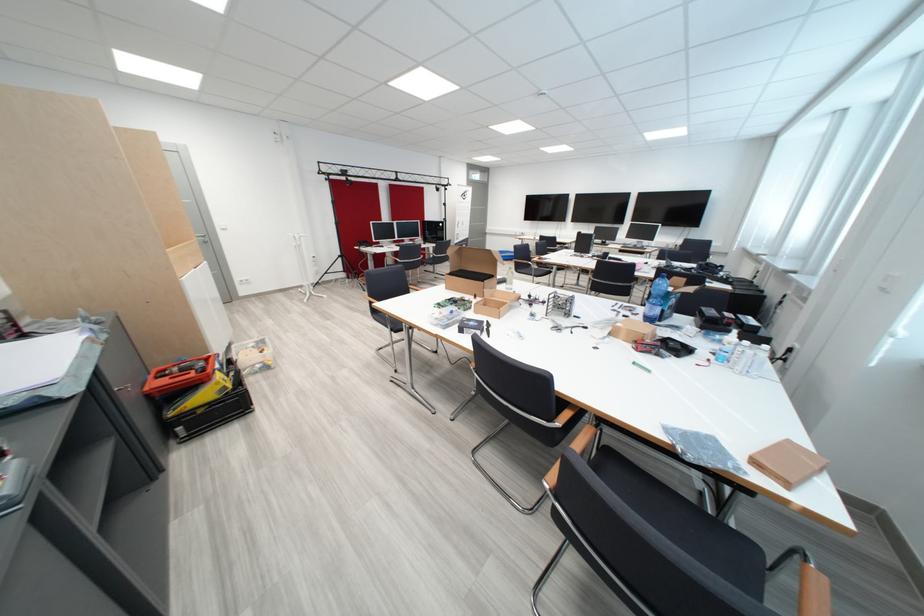
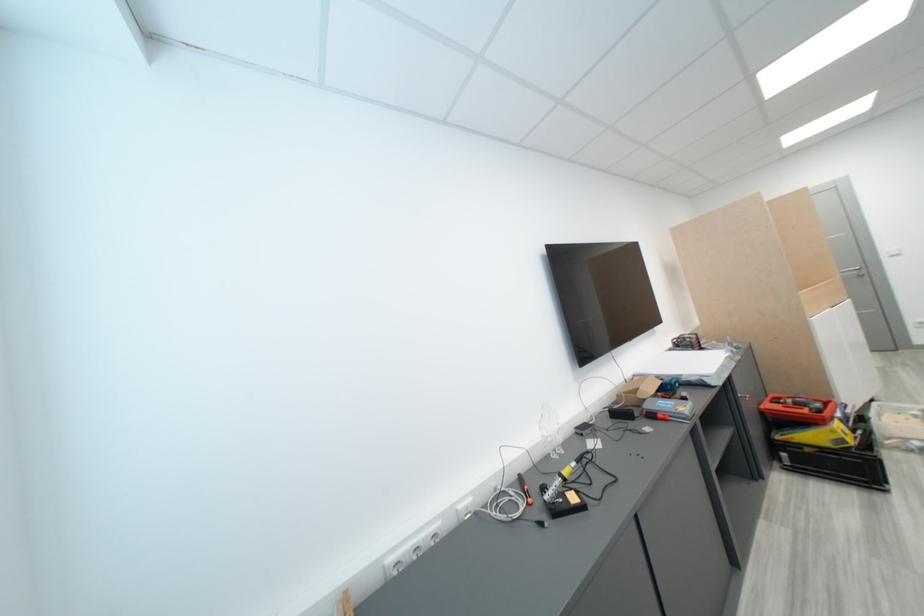
Find the pixel in the second image that matches pixel 181 416 in the first image.

(788, 439)